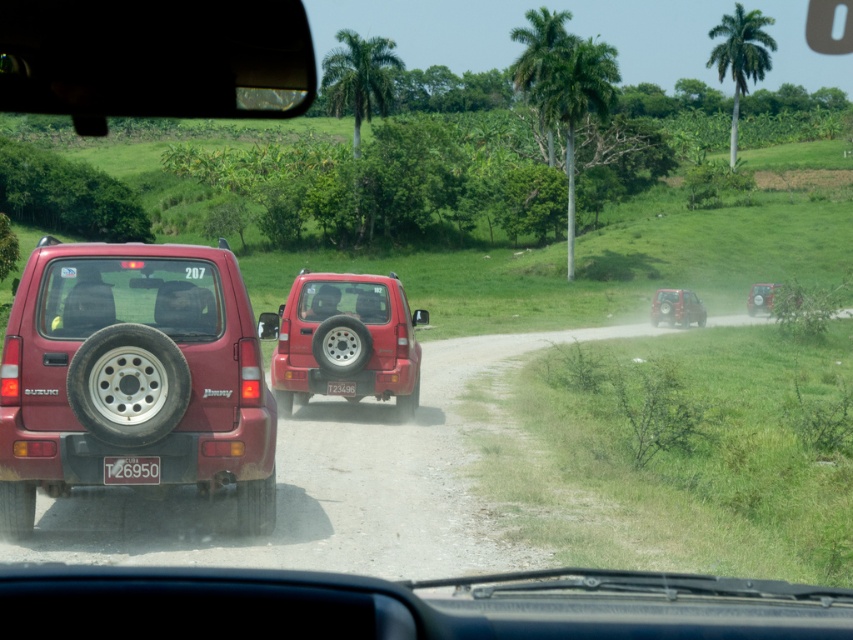
Question: Which is nearer to the silver metallic tire at center?

Choices:
 (A) matte red suv at center
 (B) black rubber tire at rear
 (C) black rubber tire at lower left
 (D) white plastic license plate at center

Answer: (A)

Question: Is black rubber tire at rear smaller than matte red jeep at right?

Choices:
 (A) yes
 (B) no

Answer: (A)

Question: Is silver metallic tire at center to the left of black rubber tire at rear from the viewer's perspective?

Choices:
 (A) yes
 (B) no

Answer: (B)

Question: Which object appears closest to the camera in this image?

Choices:
 (A) white plastic license plate at center
 (B) black rubber tire at rear left
 (C) rubber/textured tire at rear

Answer: (B)

Question: Can you confirm if silver metallic tire at center is wider than black rubber tire at rear?

Choices:
 (A) no
 (B) yes

Answer: (B)

Question: Which of the following is the closest to the observer?

Choices:
 (A) (380, 276)
 (B) (143, 468)

Answer: (B)